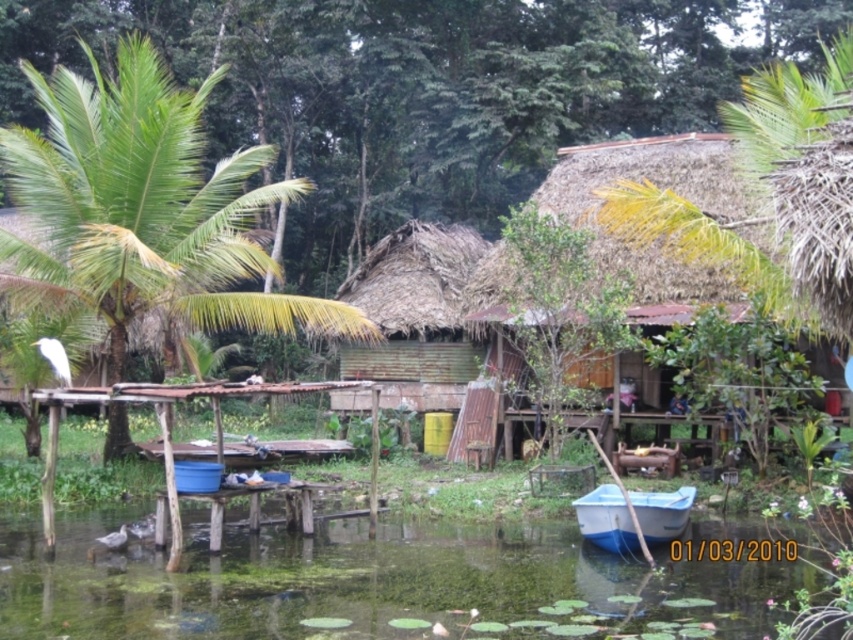
Does point (383, 307) come closer to viewer compared to point (613, 486)?

No, it is behind (613, 486).

Between point (389, 310) and point (578, 499), which one is positioned behind?

The point (389, 310) is more distant.

Identify the location of green corrugated metal hut at center. The width and height of the screenshot is (853, 640). (415, 316).

Is green mossy water at lower center thinner than green leafy palm tree at left?

Yes.

Is point (331, 554) positioned behind point (201, 100)?

No, it is not.

Who is more forward, (817, 586) or (70, 282)?

Point (817, 586) is more forward.

The height and width of the screenshot is (640, 853). Find the location of `green mossy water at lower center`. green mossy water at lower center is located at coordinates (389, 582).

Can you confirm if green mossy water at lower center is positioned above green corrugated metal hut at center?

Incorrect, green mossy water at lower center is not positioned above green corrugated metal hut at center.

Can you confirm if green mossy water at lower center is taller than green corrugated metal hut at center?

No, green mossy water at lower center is not taller than green corrugated metal hut at center.

Image resolution: width=853 pixels, height=640 pixels. Identify the location of green mossy water at lower center. (389, 582).

This screenshot has width=853, height=640. Identify the location of green mossy water at lower center. (389, 582).